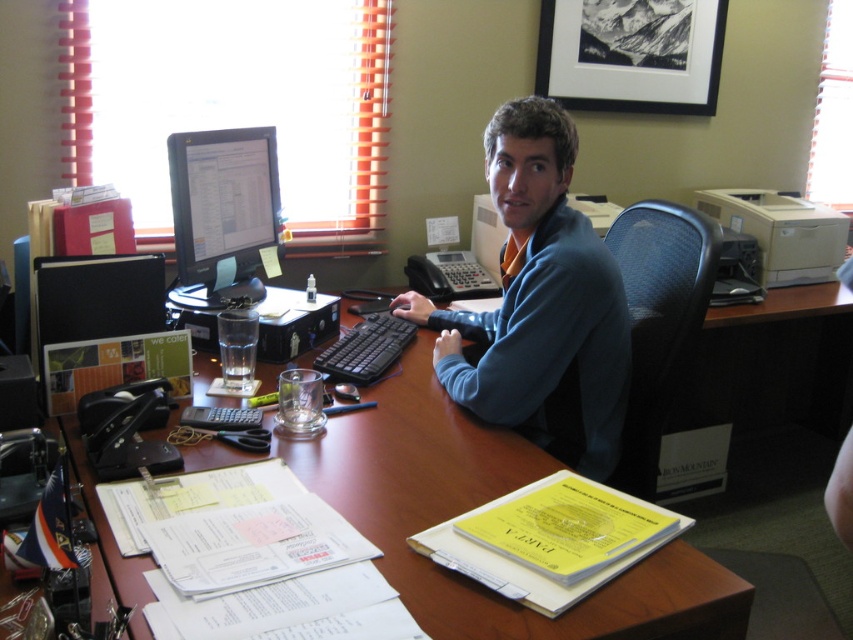
Is point (440, 400) less distant than point (608, 272)?

That is False.

Does brown wood computer desk at center have a lesser width compared to blue cotton shirt at center?

Incorrect, brown wood computer desk at center's width is not less than blue cotton shirt at center's.

Identify the location of brown wood computer desk at center. The width and height of the screenshot is (853, 640). (480, 502).

The image size is (853, 640). Find the location of `brown wood computer desk at center`. brown wood computer desk at center is located at coordinates (480, 502).

Who is higher up, blue cotton shirt at center or matte black monitor at center?

matte black monitor at center

Is blue cotton shirt at center bigger than matte black monitor at center?

Correct, blue cotton shirt at center is larger in size than matte black monitor at center.

Who is more forward, (550,100) or (196,193)?

Point (550,100)

I want to click on blue cotton shirt at center, so click(x=540, y=305).

Is brown wood computer desk at center above matte black monitor at center?

No.

Is brown wood computer desk at center wider than matte black monitor at center?

Yes.

Who is more distant from viewer, (666,609) or (202,262)?

Point (202,262)

Identify the location of brown wood computer desk at center. This screenshot has width=853, height=640. (480, 502).